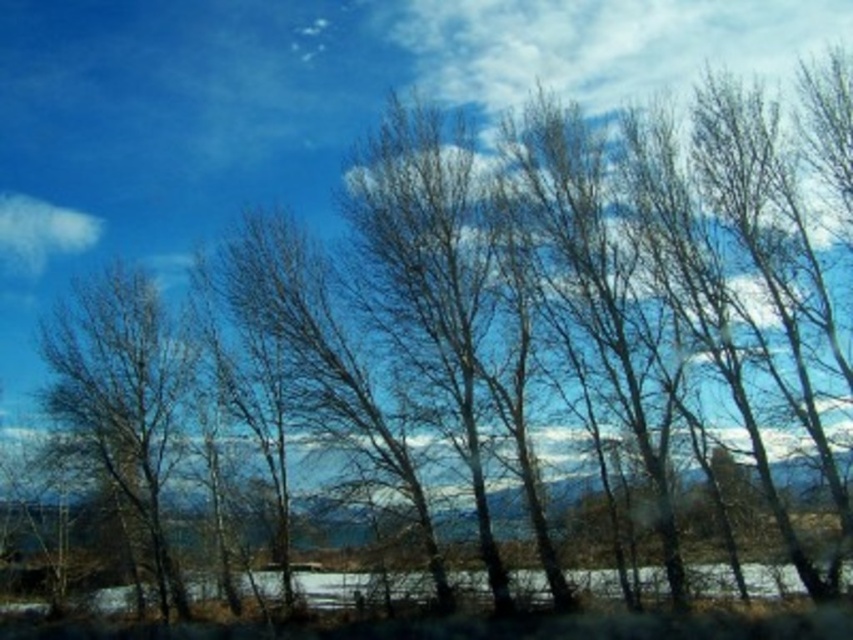
Between bare branches at left and white fluffy cloud at upper left, which one is positioned lower?

bare branches at left is lower down.

Between bare branches at left and white fluffy cloud at upper left, which one has more height?

With more height is bare branches at left.

Who is more distant from viewer, (120, 385) or (97, 221)?

The point (97, 221) is more distant.

Identify the location of bare branches at left. (120, 401).